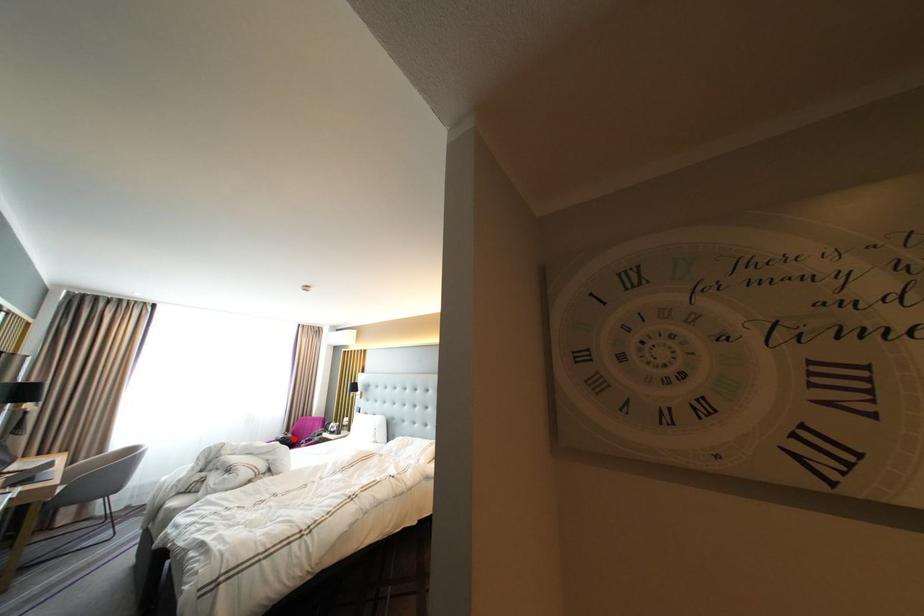
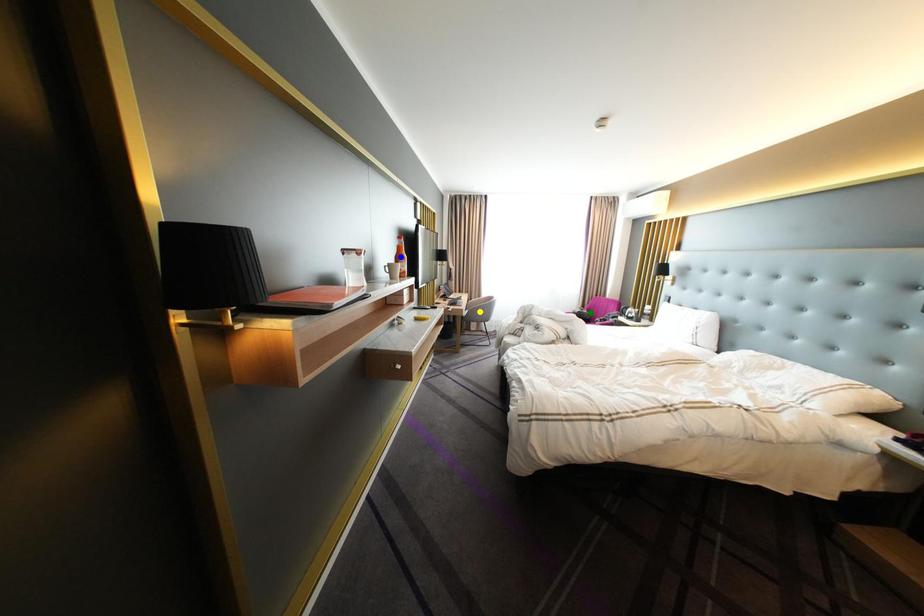
Question: I am providing you with two images of the same scene from different viewpoints. A red point is marked on the first image. You are given multiple points on the second image. Which point in image 2 is actually the same real-world point as the red point in image 1?

Choices:
 (A) green point
 (B) blue point
 (C) yellow point

Answer: (A)